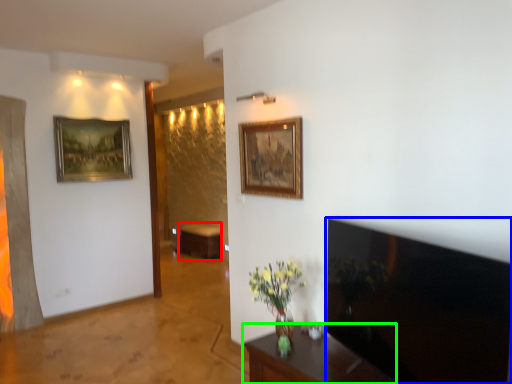
Question: Which is nearer to the table (highlighted by a red box)? television (highlighted by a blue box) or furniture (highlighted by a green box).

Choices:
 (A) television
 (B) furniture

Answer: (B)